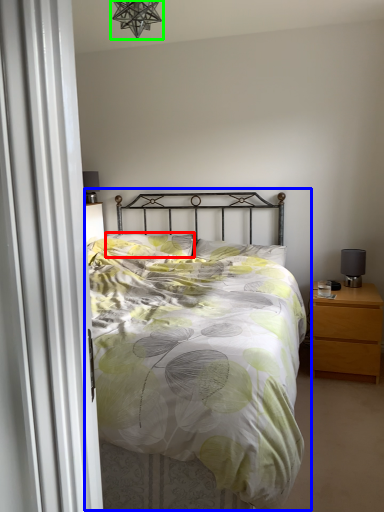
Question: Estimate the real-world distances between objects in this image. Which object is closer to pillow (highlighted by a red box), bed (highlighted by a blue box) or light fixture (highlighted by a green box)?

Choices:
 (A) bed
 (B) light fixture

Answer: (A)